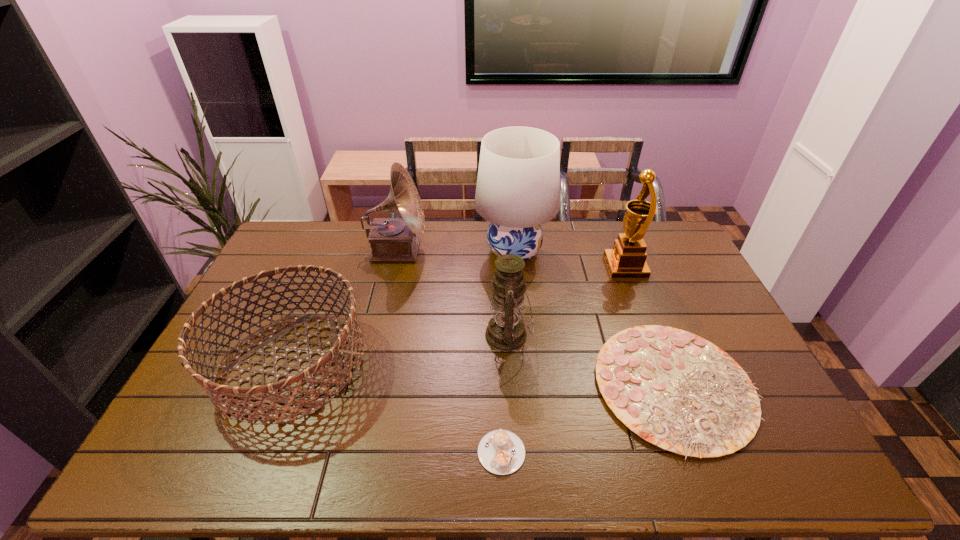
Locate an element on the screen. lampshade is located at coordinates (518, 185).

Where is `award`? The width and height of the screenshot is (960, 540). award is located at coordinates (627, 260).

Locate an element on the screen. Image resolution: width=960 pixels, height=540 pixels. phonograph record is located at coordinates (391, 239).

Identify the location of the fourth tallest object. (506, 331).

Identify the location of the third shortest object. This screenshot has height=540, width=960. (338, 340).

Where is `pizza`? This screenshot has width=960, height=540. pizza is located at coordinates (676, 390).

Find the location of a particular element. This screenshot has width=960, height=540. the shortest object is located at coordinates (501, 452).

In order to click on vacant space located 0.220m on the front-facing side of the lampshade in this screenshot , I will do `click(416, 252)`.

Identify the location of free point located 0.060m on the front-facing side of the lampshade. (459, 252).

Identify the location of free space located 0.110m on the front-facing side of the lampshade. (445, 252).